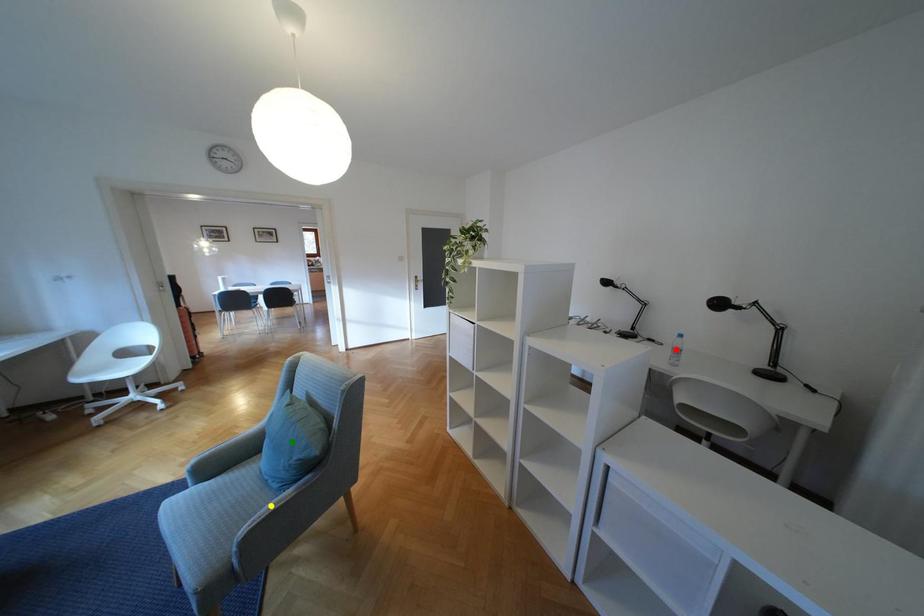
Order these from farthest to nearest:
red point, green point, yellow point

red point
green point
yellow point